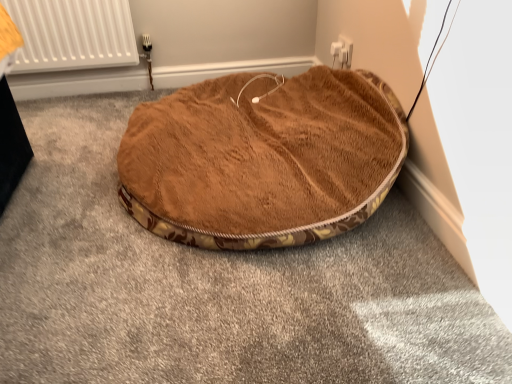
Question: Is white plastic electric outlet at upper center oriented towards brown plush dog bed at center?

Choices:
 (A) no
 (B) yes

Answer: (B)

Question: Is white plastic electric outlet at upper center smaller than brown plush dog bed at center?

Choices:
 (A) yes
 (B) no

Answer: (A)

Question: Does white plastic electric outlet at upper center have a larger size compared to brown plush dog bed at center?

Choices:
 (A) yes
 (B) no

Answer: (B)

Question: Considering the relative sizes of white plastic electric outlet at upper center and brown plush dog bed at center in the image provided, is white plastic electric outlet at upper center thinner than brown plush dog bed at center?

Choices:
 (A) yes
 (B) no

Answer: (A)

Question: Is white plastic electric outlet at upper center oriented away from brown plush dog bed at center?

Choices:
 (A) yes
 (B) no

Answer: (B)

Question: Is white plastic electric outlet at upper center in contact with brown plush dog bed at center?

Choices:
 (A) no
 (B) yes

Answer: (A)

Question: Could white plastic electric outlet at upper center be considered to be inside brown plush dog bed at center?

Choices:
 (A) yes
 (B) no

Answer: (B)

Question: Can you confirm if brown plush dog bed at center is smaller than white plastic electric outlet at upper center?

Choices:
 (A) yes
 (B) no

Answer: (B)

Question: Is brown plush dog bed at center far away from white plastic electric outlet at upper center?

Choices:
 (A) yes
 (B) no

Answer: (B)

Question: Considering the relative sizes of brown plush dog bed at center and white plastic electric outlet at upper center in the image provided, is brown plush dog bed at center wider than white plastic electric outlet at upper center?

Choices:
 (A) no
 (B) yes

Answer: (B)

Question: From a real-world perspective, is brown plush dog bed at center beneath white plastic electric outlet at upper center?

Choices:
 (A) yes
 (B) no

Answer: (A)

Question: From the image's perspective, does brown plush dog bed at center appear lower than white plastic electric outlet at upper center?

Choices:
 (A) no
 (B) yes

Answer: (B)

Question: From their relative heights in the image, would you say white plastic electric outlet at upper center is taller or shorter than brown plush dog bed at center?

Choices:
 (A) tall
 (B) short

Answer: (B)